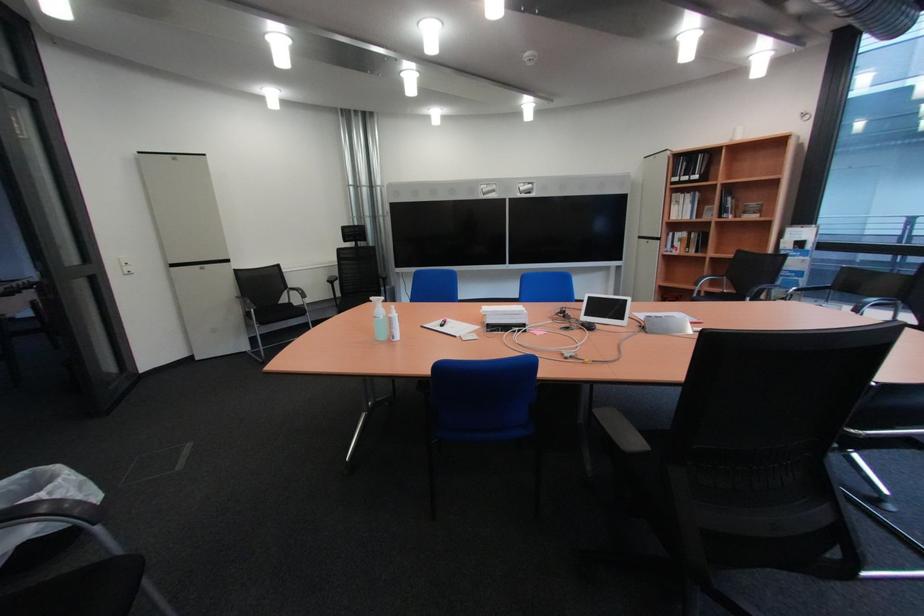
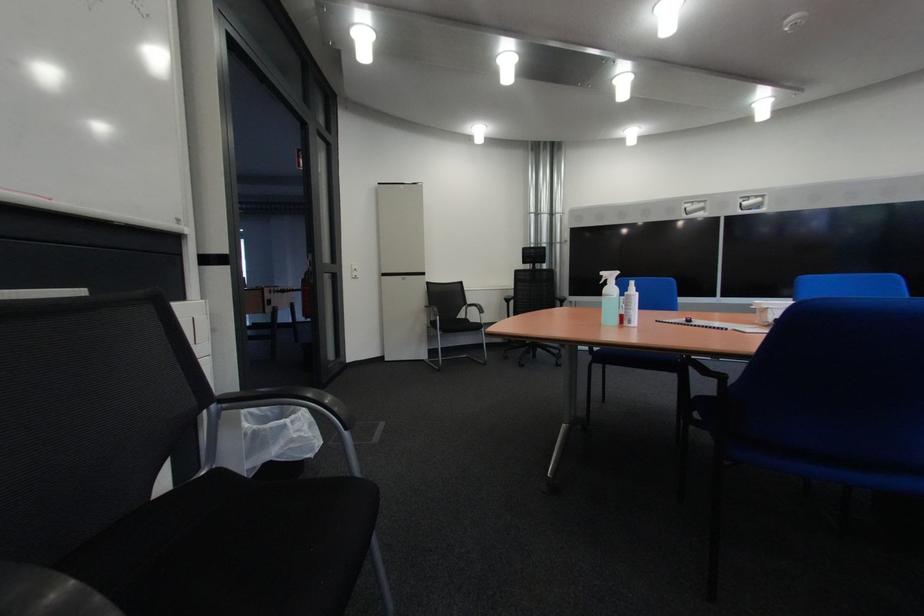
Question: The images are taken continuously from a first-person perspective. In which direction is your viewpoint rotating?

Choices:
 (A) Left
 (B) Right
 (C) Up
 (D) Down

Answer: (A)